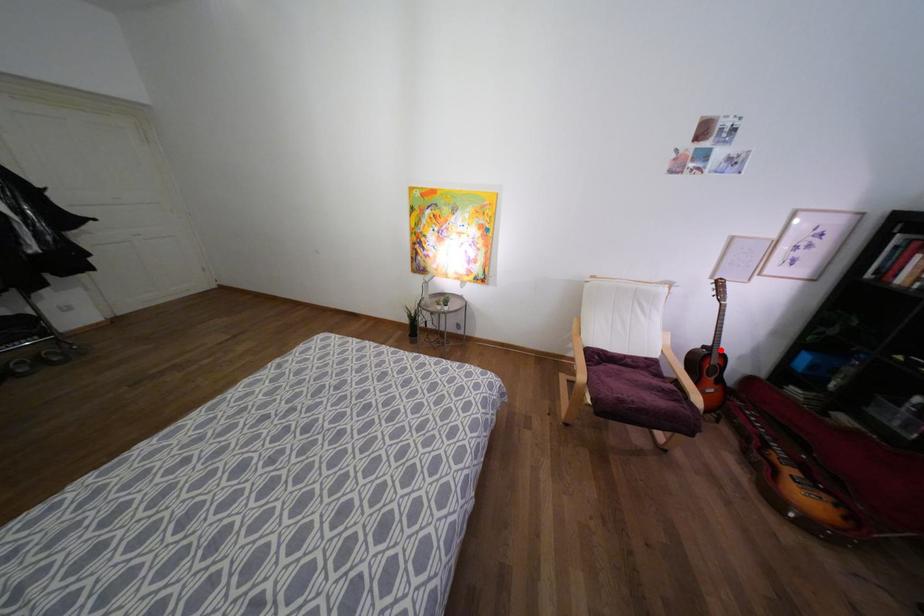
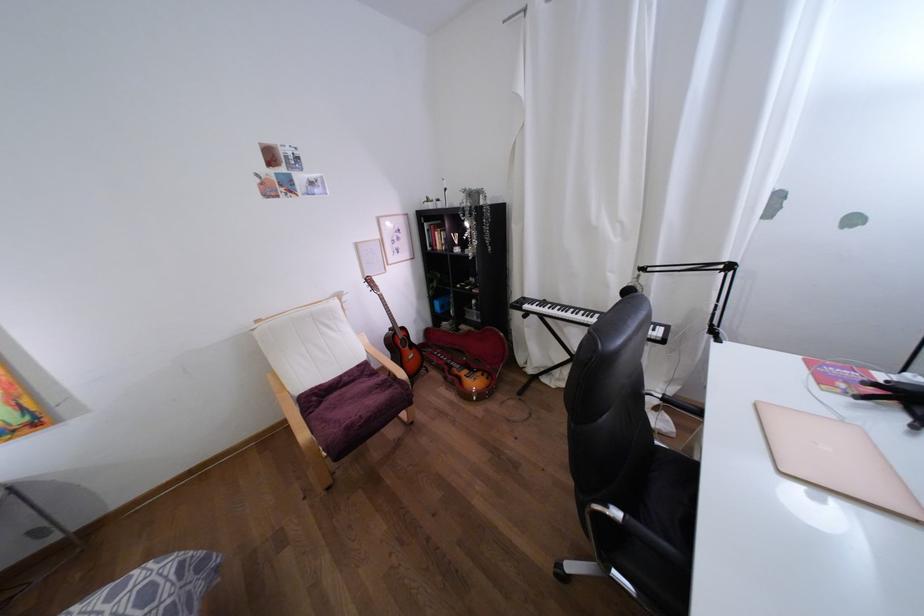
Question: I am providing you with two images of the same scene from different viewpoints. In image1, a red point is highlighted. Considering the same 3D point in image2, which of the following is correct?

Choices:
 (A) It is closer
 (B) It is farther

Answer: (A)